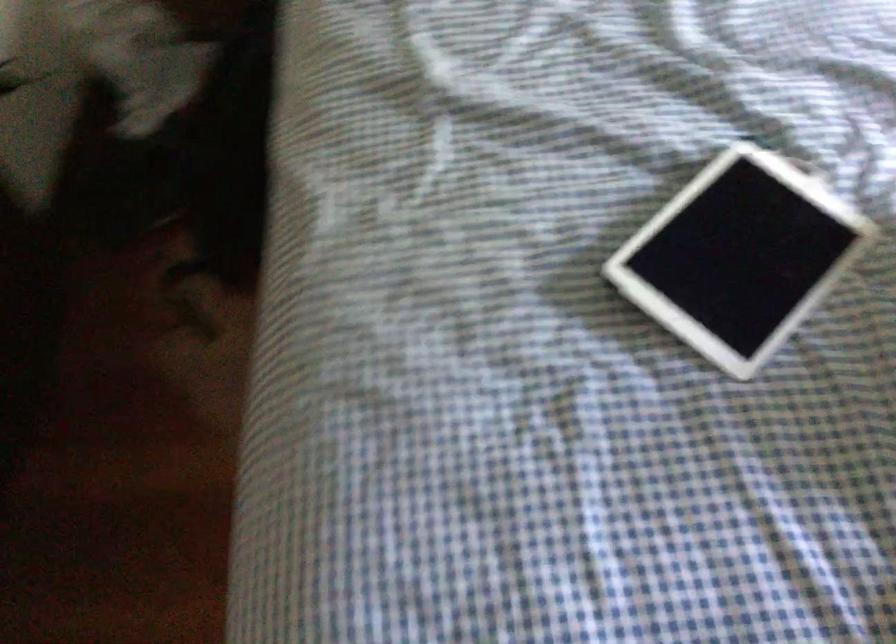
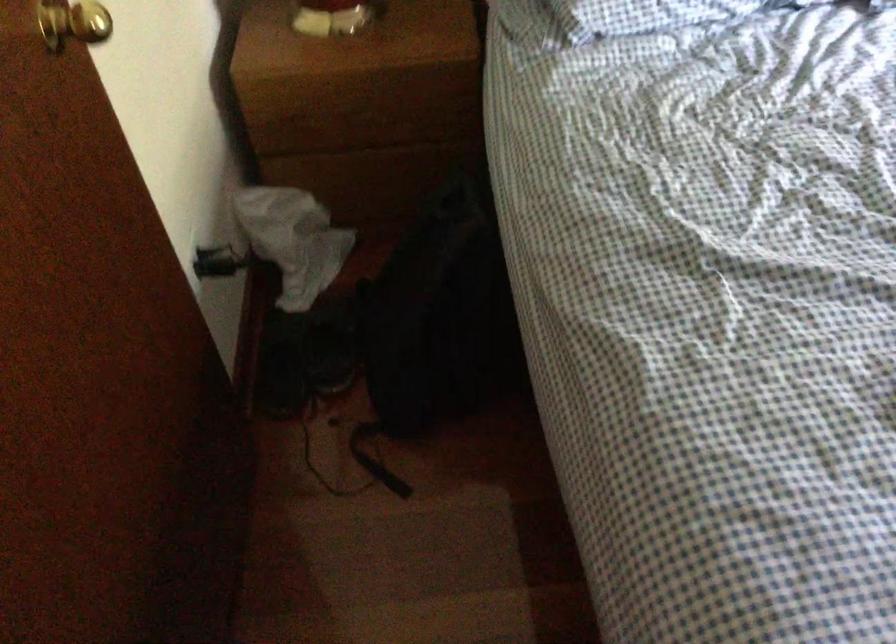
Where in the second image is the point corresponding to point 236,152 from the first image?

(441, 317)